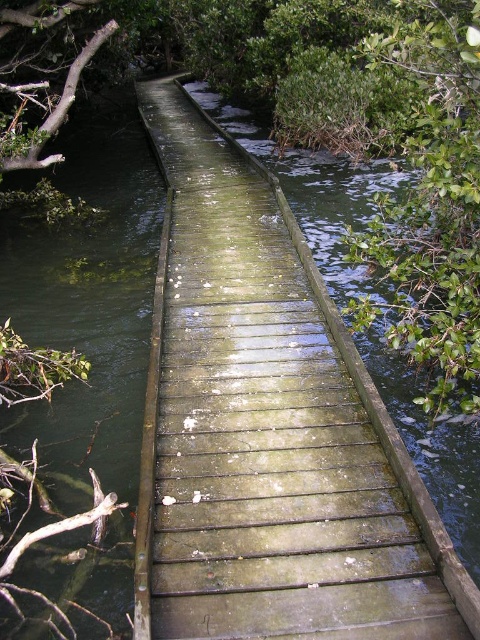
Question: Which object appears closest to the camera in this image?

Choices:
 (A) green leafy tree at right
 (B) green mossy wood at center
 (C) green leafy branch at upper left

Answer: (B)

Question: Can you confirm if green leafy tree at right is bigger than green leafy branch at upper left?

Choices:
 (A) no
 (B) yes

Answer: (A)

Question: Can you confirm if green mossy wood at center is bigger than green leafy tree at right?

Choices:
 (A) yes
 (B) no

Answer: (A)

Question: Considering the relative positions of green mossy wood at center and green leafy tree at right in the image provided, where is green mossy wood at center located with respect to green leafy tree at right?

Choices:
 (A) left
 (B) right

Answer: (A)

Question: Which point is farther to the camera?

Choices:
 (A) green mossy wood at center
 (B) green leafy tree at right
 (C) green leafy branch at upper left

Answer: (C)

Question: Which of these objects is positioned farthest from the green leafy branch at upper left?

Choices:
 (A) green leafy tree at right
 (B) green mossy wood at center

Answer: (A)